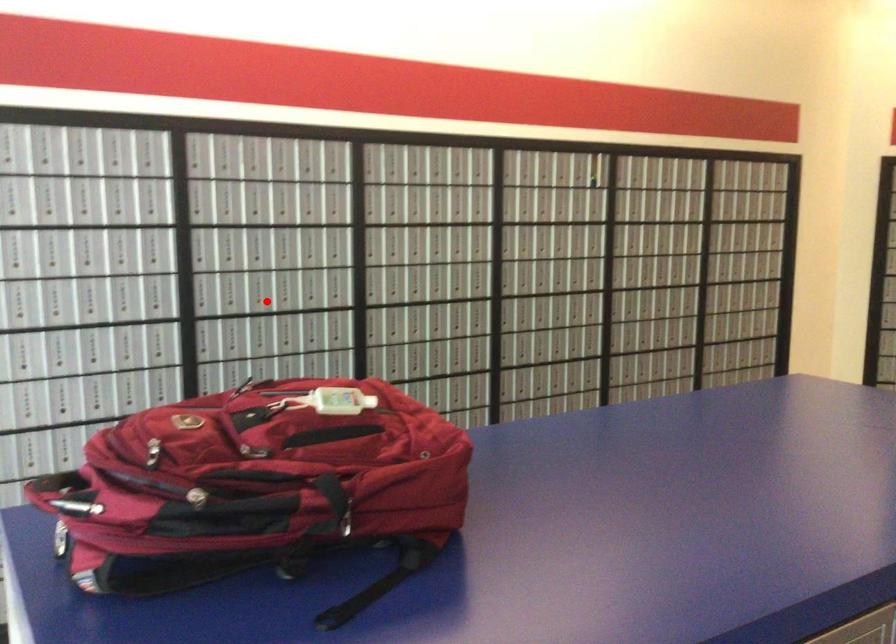
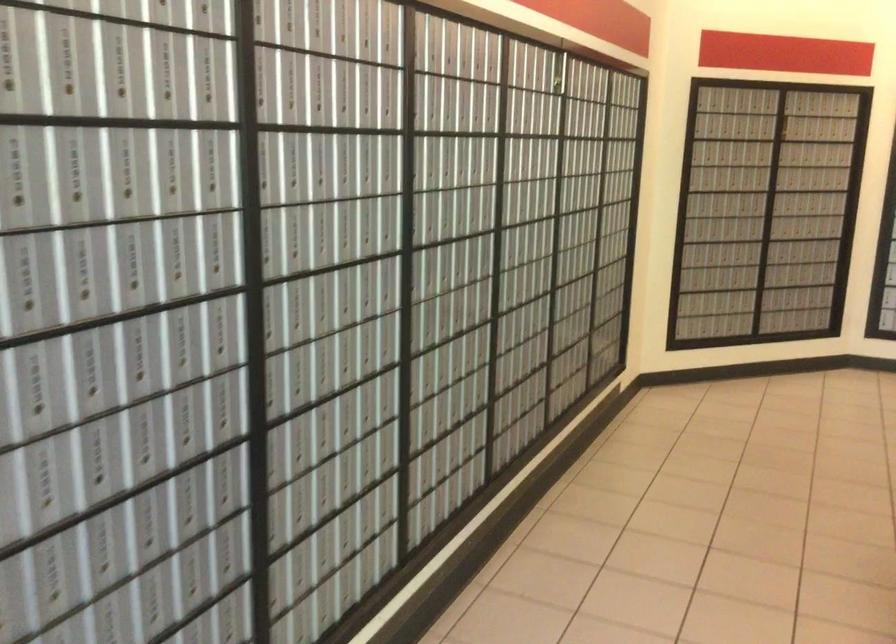
Question: I am providing you with two images of the same scene from different viewpoints. Given a red point in image1, look at the same physical point in image2. Is it:

Choices:
 (A) Closer to the viewpoint
 (B) Farther from the viewpoint

Answer: (A)